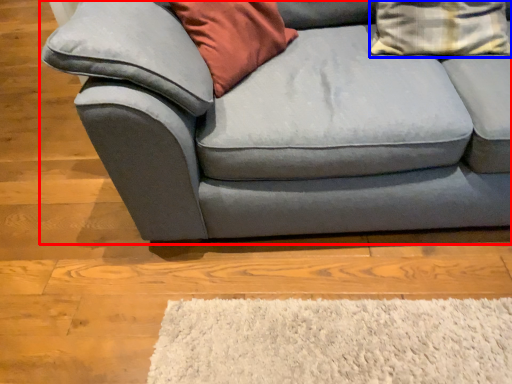
Question: Which of the following is the farthest to the observer, studio couch (highlighted by a red box) or pillow (highlighted by a blue box)?

Choices:
 (A) studio couch
 (B) pillow

Answer: (B)